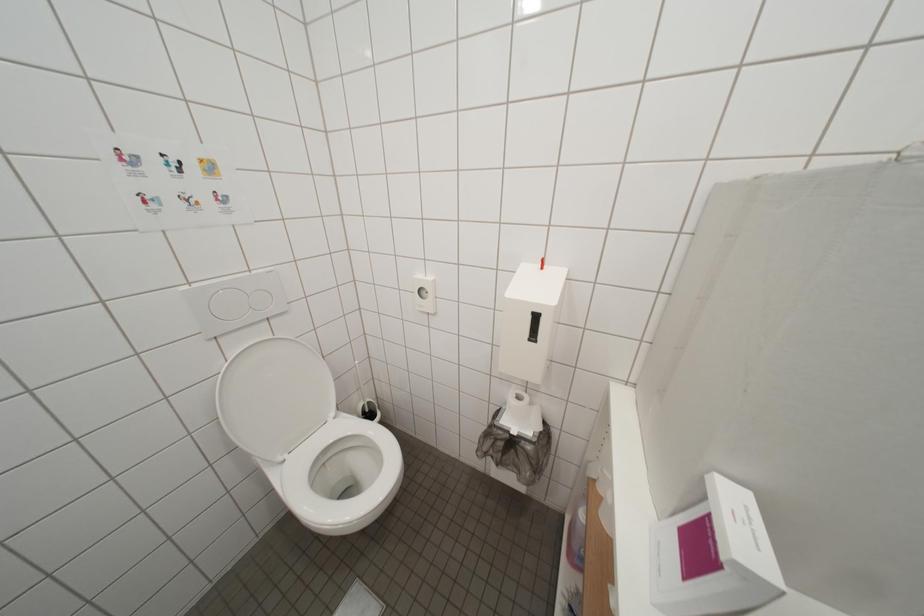
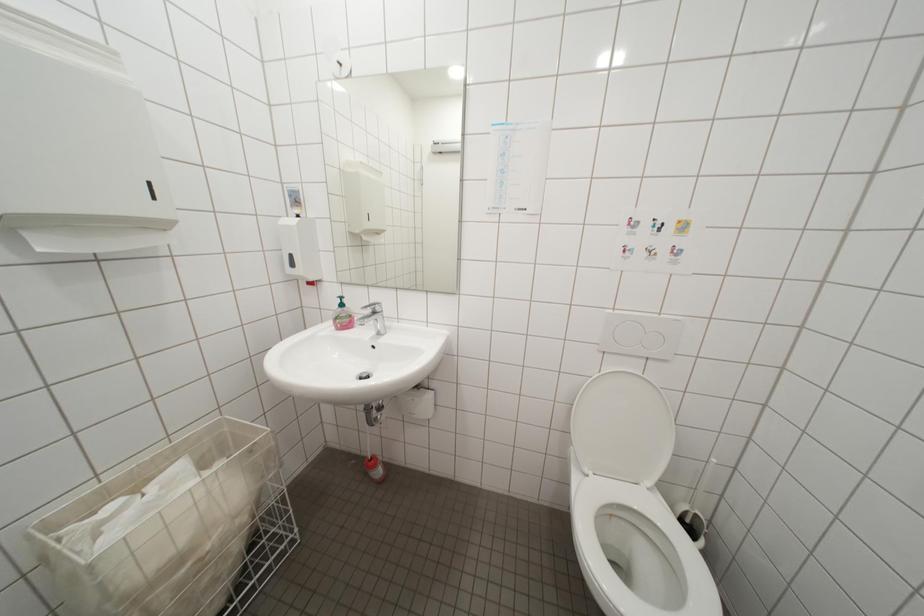
Question: The camera is either moving clockwise (left) or counter-clockwise (right) around the object. The first image is from the beginning of the video and the second image is from the end. Is the camera moving left or right when shooting the video?

Choices:
 (A) Left
 (B) Right

Answer: (B)